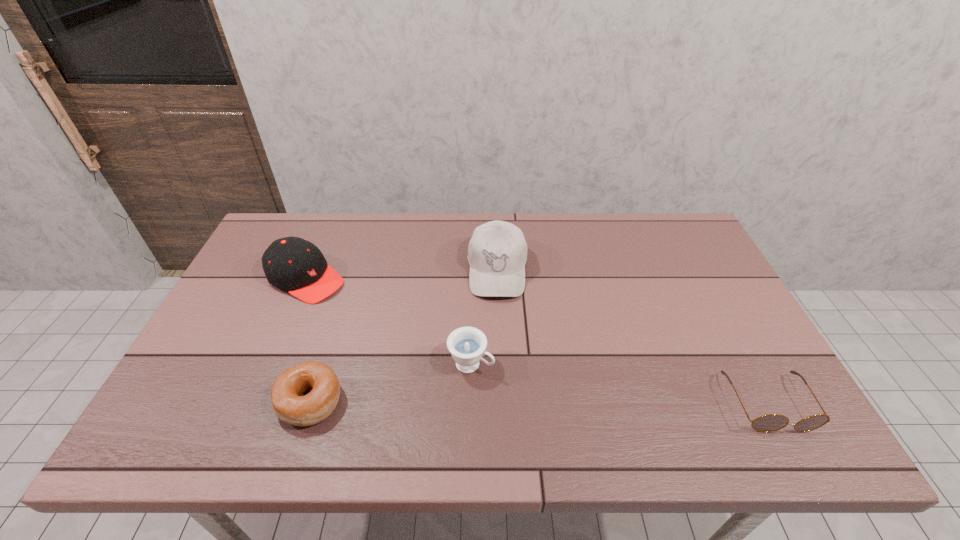
Image resolution: width=960 pixels, height=540 pixels. In order to click on vacant space on the desktop that is between the bagel and the rightmost object and is positioned on the front-facing side of the cap in this screenshot , I will do point(512,402).

Find the location of a particular element. The width and height of the screenshot is (960, 540). vacant space on the desktop that is between the bagel and the sunglasses and is positioned on the front-facing side of the baseball cap is located at coordinates (495, 402).

Locate an element on the screen. The height and width of the screenshot is (540, 960). vacant spot on the desktop that is between the bagel and the rightmost object and is positioned on the side of the teacup with the handle is located at coordinates (545, 402).